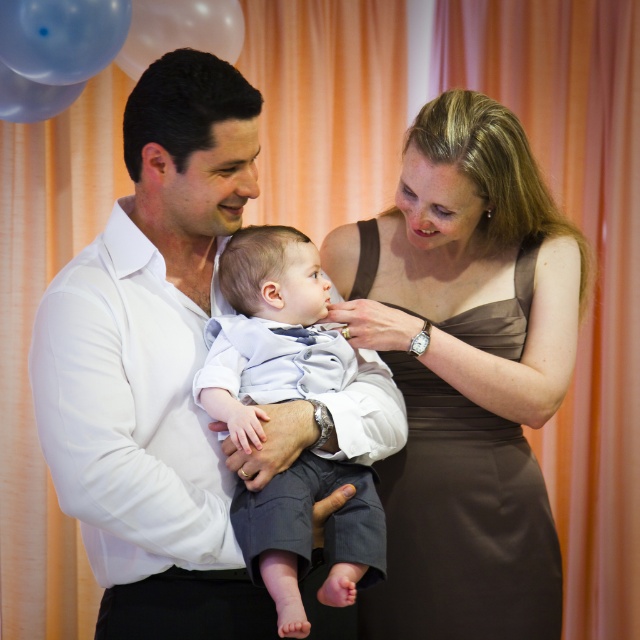
Between brown satin dress at center and light blue cotton shirt at center, which one has less height?

light blue cotton shirt at center is shorter.

You are a GUI agent. You are given a task and a screenshot of the screen. Output one action in this format:
    pyautogui.click(x=<x>, y=<y>)
    Task: Click on the brown satin dress at center
    
    Given the screenshot: What is the action you would take?
    pyautogui.click(x=461, y=524)

Where is `brown satin dress at center`? The height and width of the screenshot is (640, 640). brown satin dress at center is located at coordinates (461, 524).

Who is positioned more to the left, light blue cotton shirt at center or transparent plastic balloon at upper left?

From the viewer's perspective, transparent plastic balloon at upper left appears more on the left side.

Between light blue cotton shirt at center and transparent plastic balloon at upper left, which one is positioned lower?

light blue cotton shirt at center is lower down.

You are a GUI agent. You are given a task and a screenshot of the screen. Output one action in this format:
    pyautogui.click(x=<x>, y=<y>)
    Task: Click on the light blue cotton shirt at center
    
    Given the screenshot: What is the action you would take?
    pyautogui.click(x=269, y=332)

Does brown satin dress at center appear on the left side of translucent plastic balloon at upper left?

In fact, brown satin dress at center is to the right of translucent plastic balloon at upper left.

Does point (454, 429) come closer to viewer compared to point (198, 32)?

Yes, it is in front of point (198, 32).

I want to click on brown satin dress at center, so click(461, 524).

Locate an element on the screen. This screenshot has height=640, width=640. brown satin dress at center is located at coordinates (461, 524).